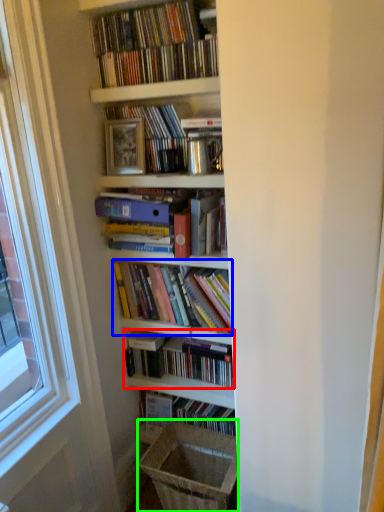
Question: Considering the real-world distances, which object is farthest from book (highlighted by a red box)? book (highlighted by a blue box) or laundry basket (highlighted by a green box)?

Choices:
 (A) book
 (B) laundry basket

Answer: (B)